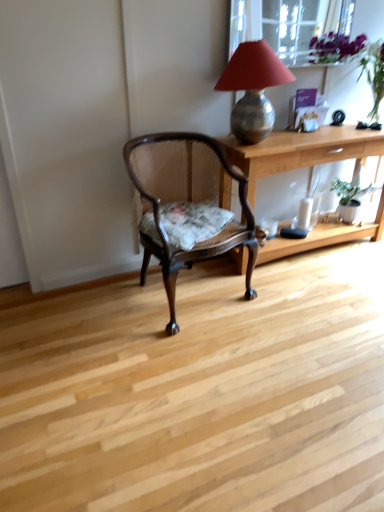
Find the location of a particular element. green matte houseplant at right is located at coordinates (350, 199).

What are the coordinates of `metallic textured lamp at upper right` in the screenshot? It's located at (253, 89).

From the image's perspective, is metallic textured lamp at upper right over mahogany cane chair at center?

Yes, from the image's perspective, metallic textured lamp at upper right is over mahogany cane chair at center.

Does metallic textured lamp at upper right have a lesser width compared to mahogany cane chair at center?

Yes.

Can you tell me how much metallic textured lamp at upper right and mahogany cane chair at center differ in facing direction?

There is a 10.9-degree angle between the facing directions of metallic textured lamp at upper right and mahogany cane chair at center.

Locate an element on the screen. Image resolution: width=384 pixels, height=512 pixels. chair in front of the metallic textured lamp at upper right is located at coordinates (187, 205).

Is green matte houseplant at right far away from mahogany cane chair at center?

green matte houseplant at right is positioned a significant distance from mahogany cane chair at center.

Considering the relative positions of green matte houseplant at right and mahogany cane chair at center in the image provided, is green matte houseplant at right to the right of mahogany cane chair at center from the viewer's perspective?

Correct, you'll find green matte houseplant at right to the right of mahogany cane chair at center.

Which of these two, green matte houseplant at right or mahogany cane chair at center, is smaller?

green matte houseplant at right is smaller.

From the image's perspective, between green matte houseplant at right and mahogany cane chair at center, which one is located above?

green matte houseplant at right is shown above in the image.

From the image's perspective, would you say mahogany cane chair at center is shown under transparent glass window screen at upper center?

Yes.

Looking at this image, is mahogany cane chair at center taller than transparent glass window screen at upper center?

Indeed, mahogany cane chair at center has a greater height compared to transparent glass window screen at upper center.

Does mahogany cane chair at center come in front of transparent glass window screen at upper center?

Yes, the depth of mahogany cane chair at center is less than that of transparent glass window screen at upper center.

Is mahogany cane chair at center far from transparent glass window screen at upper center?

That's right, there is a large distance between mahogany cane chair at center and transparent glass window screen at upper center.

From a real-world perspective, is light wood desk at center physically located above or below transparent glass window screen at upper center?

From a real-world perspective, light wood desk at center is physically below transparent glass window screen at upper center.

Considering the sizes of objects light wood desk at center and transparent glass window screen at upper center in the image provided, who is thinner, light wood desk at center or transparent glass window screen at upper center?

Thinner between the two is transparent glass window screen at upper center.

Would you say light wood desk at center is a long distance from transparent glass window screen at upper center?

light wood desk at center is far away from transparent glass window screen at upper center.

Does light wood desk at center have a lesser height compared to transparent glass window screen at upper center?

Incorrect, the height of light wood desk at center does not fall short of that of transparent glass window screen at upper center.

What's the angular difference between transparent glass window screen at upper center and light wood desk at center's facing directions?

transparent glass window screen at upper center and light wood desk at center are facing 0.793 degrees away from each other.

From the image's perspective, which one is positioned higher, transparent glass window screen at upper center or light wood desk at center?

transparent glass window screen at upper center appears higher in the image.

Is transparent glass window screen at upper center next to light wood desk at center and touching it?

No, transparent glass window screen at upper center is not beside light wood desk at center.

Is light wood desk at center spatially inside green matte houseplant at right, or outside of it?

light wood desk at center is not enclosed by green matte houseplant at right.

Considering the positions of objects light wood desk at center and green matte houseplant at right in the image provided, who is behind, light wood desk at center or green matte houseplant at right?

green matte houseplant at right is further from the camera.

From a real-world perspective, between light wood desk at center and green matte houseplant at right, who is vertically higher?

In real-world perspective, light wood desk at center is above.

Which point is more forward, (245, 133) or (280, 53)?

Point (245, 133)

How far apart are metallic textured lamp at upper right and transparent glass window screen at upper center?

metallic textured lamp at upper right is 2.06 meters from transparent glass window screen at upper center.

From the image's perspective, which one is positioned higher, metallic textured lamp at upper right or transparent glass window screen at upper center?

transparent glass window screen at upper center appears higher in the image.

From a real-world perspective, is metallic textured lamp at upper right positioned above or below transparent glass window screen at upper center?

Clearly, from a real-world perspective, metallic textured lamp at upper right is below transparent glass window screen at upper center.

Where is `lamp located above the mahogany cane chair at center (from the image's perspective)`? lamp located above the mahogany cane chair at center (from the image's perspective) is located at coordinates (253, 89).

Where is `houseplant behind the mahogany cane chair at center`? Image resolution: width=384 pixels, height=512 pixels. houseplant behind the mahogany cane chair at center is located at coordinates (350, 199).

Based on their spatial positions, is transparent glass window screen at upper center or green matte houseplant at right further from metallic textured lamp at upper right?

The object further to metallic textured lamp at upper right is transparent glass window screen at upper center.

Based on the photo, estimate the real-world distances between objects in this image. Which object is further from metallic textured lamp at upper right, light wood desk at center or green matte houseplant at right?

Among the two, green matte houseplant at right is located further to metallic textured lamp at upper right.

Estimate the real-world distances between objects in this image. Which object is closer to green matte houseplant at right, light wood desk at center or transparent glass window screen at upper center?

Among the two, light wood desk at center is located nearer to green matte houseplant at right.

Looking at this image, from the image, which object appears to be nearer to mahogany cane chair at center, transparent glass window screen at upper center or light wood desk at center?

light wood desk at center is positioned closer to the anchor mahogany cane chair at center.

Considering their positions, is transparent glass window screen at upper center positioned further to mahogany cane chair at center than green matte houseplant at right?

transparent glass window screen at upper center lies further to mahogany cane chair at center than the other object.

Looking at the image, which one is located closer to light wood desk at center, metallic textured lamp at upper right or mahogany cane chair at center?

metallic textured lamp at upper right.

Considering their positions, is mahogany cane chair at center positioned closer to light wood desk at center than transparent glass window screen at upper center?

mahogany cane chair at center is positioned closer to the anchor light wood desk at center.

Based on their spatial positions, is metallic textured lamp at upper right or green matte houseplant at right further from mahogany cane chair at center?

The object further to mahogany cane chair at center is green matte houseplant at right.

Image resolution: width=384 pixels, height=512 pixels. In order to click on lamp between transparent glass window screen at upper center and green matte houseplant at right in the up-down direction in this screenshot , I will do `click(253, 89)`.

Where is `lamp located between mahogany cane chair at center and green matte houseplant at right in the left-right direction`? This screenshot has width=384, height=512. lamp located between mahogany cane chair at center and green matte houseplant at right in the left-right direction is located at coordinates (253, 89).

The image size is (384, 512). Find the location of `lamp that lies between transparent glass window screen at upper center and light wood desk at center from top to bottom`. lamp that lies between transparent glass window screen at upper center and light wood desk at center from top to bottom is located at coordinates (253, 89).

Find the location of a particular element. Image resolution: width=384 pixels, height=512 pixels. desk between metallic textured lamp at upper right and green matte houseplant at right along the z-axis is located at coordinates (300, 151).